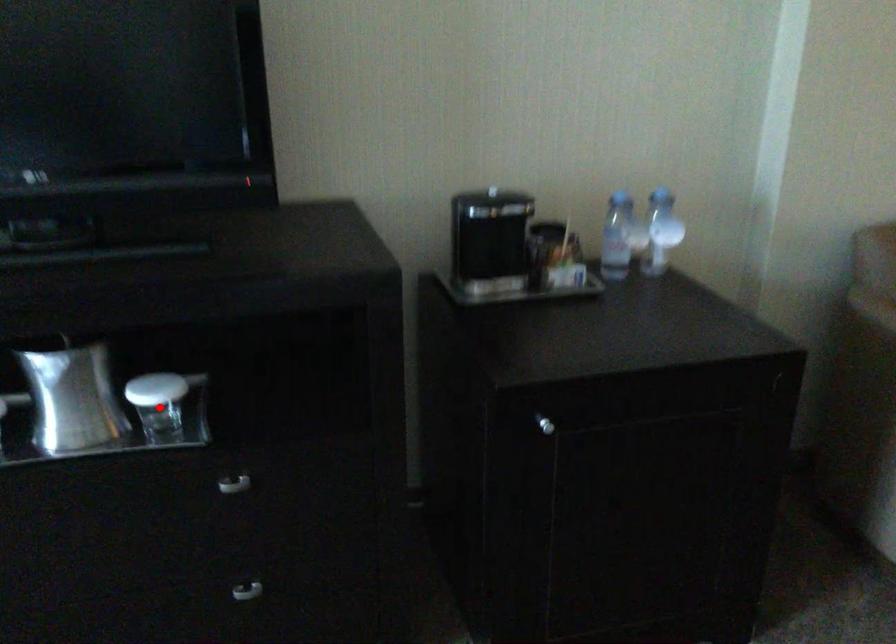
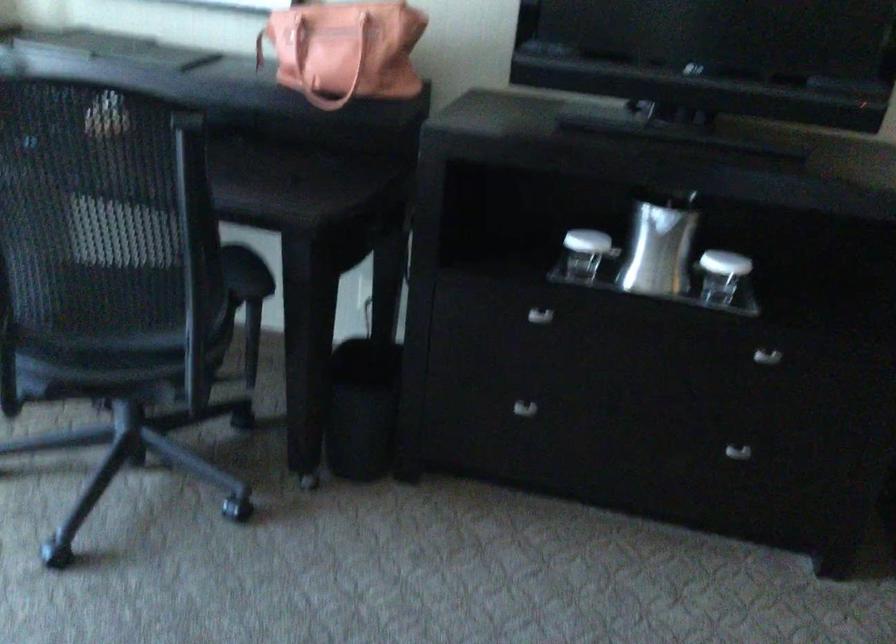
Locate, in the second image, the point that corresponds to the highlighted location in the first image.

(721, 275)